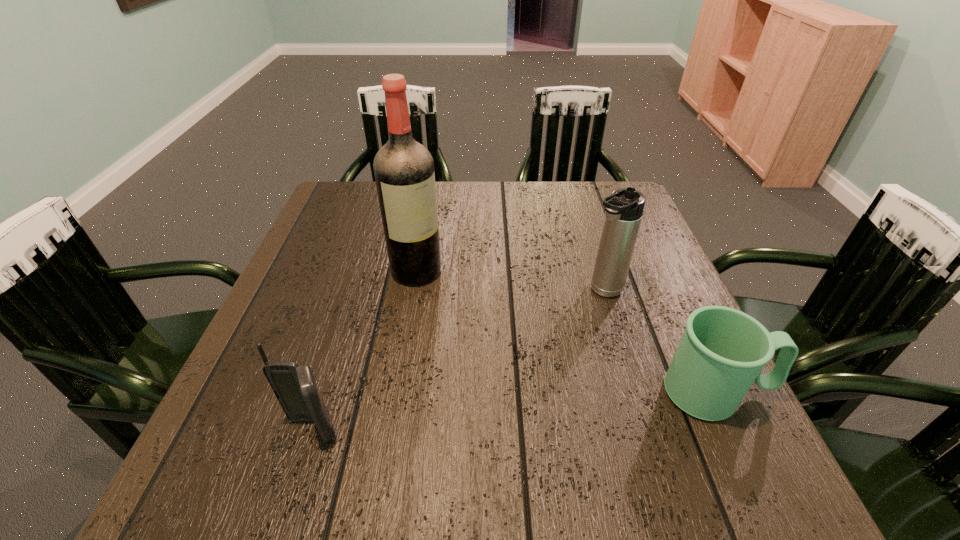
Identify the location of vacant space on the desktop that is between the cellular telephone and the mug and is positioned on the front-facing side of the tallest object. The width and height of the screenshot is (960, 540). (544, 408).

Where is `vacant space on the desktop that is between the cellular telephone and the shortest object and is positioned on the handle side of the third object from left to right`? The width and height of the screenshot is (960, 540). vacant space on the desktop that is between the cellular telephone and the shortest object and is positioned on the handle side of the third object from left to right is located at coordinates (462, 416).